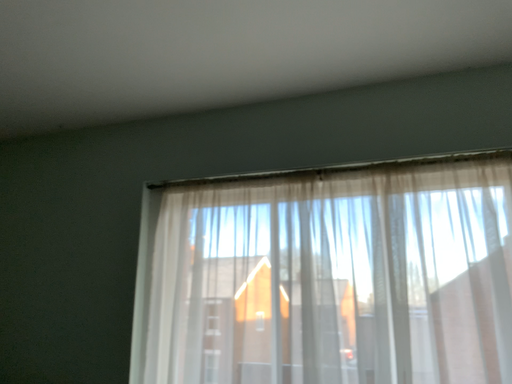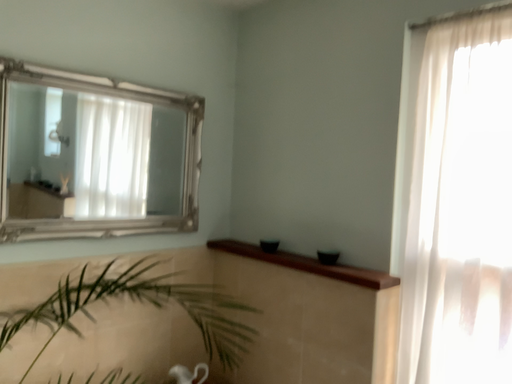
Question: How did the camera likely rotate when shooting the video?

Choices:
 (A) rotated right
 (B) rotated left

Answer: (B)